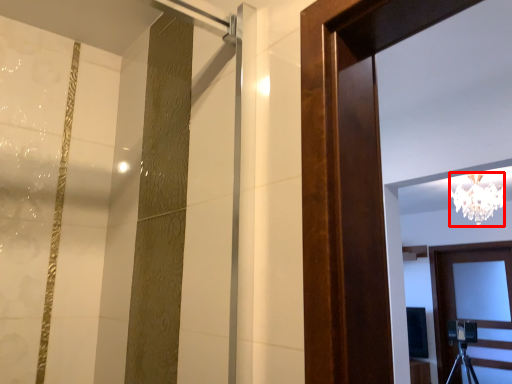
Question: In this image, where is lamp (annotated by the red box) located relative to door?

Choices:
 (A) left
 (B) right

Answer: (A)